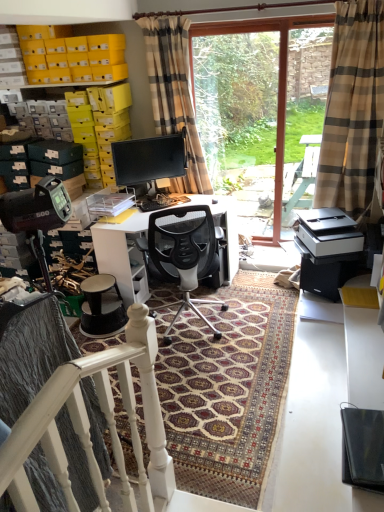
Locate an element on the screen. Image resolution: width=384 pixels, height=512 pixels. blank space situated above black plastic printer at lower right (from a real-world perspective) is located at coordinates (317, 221).